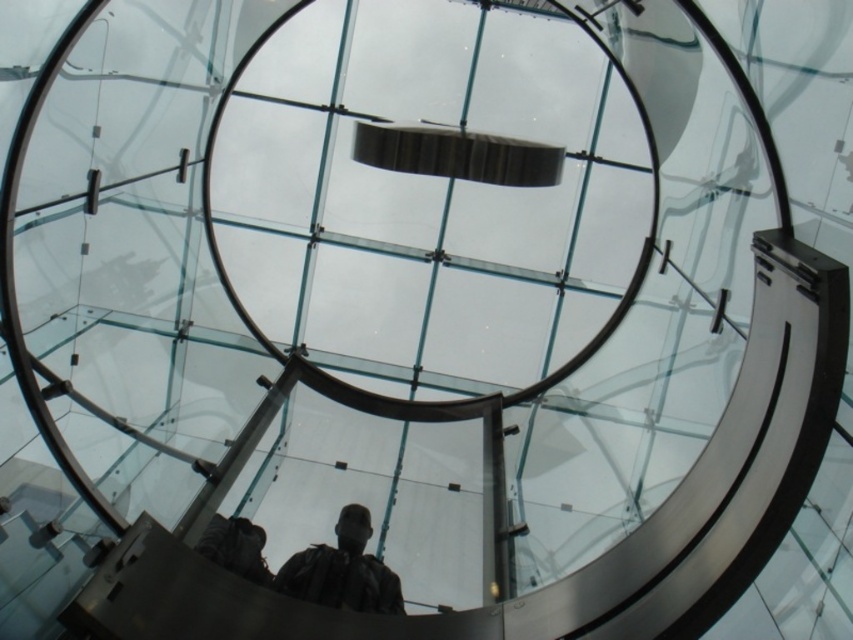
You are standing inside the dome and see a point marked at coordinates (341, 570). According to the scene description, where is this point located?

The point at (341, 570) is located on the dark brown leather jacket at lower center.

Looking at this image, you are an architect reviewing the design of the dome structure. You notice two jackets hanging near the lower section of the dome. Which jacket is closer to the floor? The jackets are the dark brown leather jacket at lower center and the dark gray jacket at lower center.

The dark brown leather jacket at lower center is closer to the floor because it is located below the dark gray jacket at lower center.